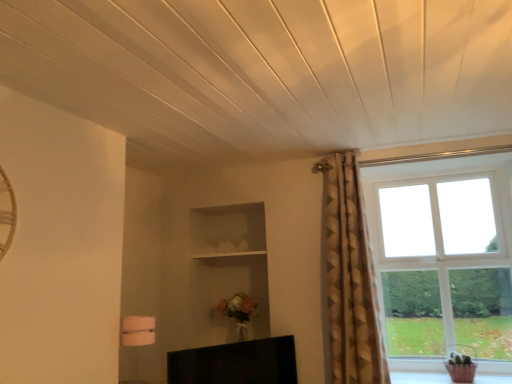
Question: Is clear glass window at right thinner than black glossy tv at lower center?

Choices:
 (A) yes
 (B) no

Answer: (B)

Question: Is clear glass window at right further to the viewer compared to black glossy tv at lower center?

Choices:
 (A) no
 (B) yes

Answer: (B)

Question: From the image's perspective, is clear glass window at right located above black glossy tv at lower center?

Choices:
 (A) no
 (B) yes

Answer: (B)

Question: Is clear glass window at right touching black glossy tv at lower center?

Choices:
 (A) yes
 (B) no

Answer: (B)

Question: Considering the relative positions of clear glass window at right and black glossy tv at lower center in the image provided, is clear glass window at right to the right of black glossy tv at lower center from the viewer's perspective?

Choices:
 (A) yes
 (B) no

Answer: (A)

Question: Based on their sizes in the image, would you say gold textured curtain at upper right is bigger or smaller than clear glass window at right?

Choices:
 (A) big
 (B) small

Answer: (A)

Question: In terms of height, does gold textured curtain at upper right look taller or shorter compared to clear glass window at right?

Choices:
 (A) tall
 (B) short

Answer: (A)

Question: Is gold textured curtain at upper right situated inside clear glass window at right or outside?

Choices:
 (A) outside
 (B) inside

Answer: (A)

Question: Is gold textured curtain at upper right in front of or behind clear glass window at right in the image?

Choices:
 (A) front
 (B) behind

Answer: (A)

Question: Is clear glass window at right inside or outside of white wooden shelf at center?

Choices:
 (A) inside
 (B) outside

Answer: (B)

Question: Considering the positions of clear glass window at right and white wooden shelf at center in the image, is clear glass window at right taller or shorter than white wooden shelf at center?

Choices:
 (A) short
 (B) tall

Answer: (B)

Question: Is clear glass window at right bigger or smaller than white wooden shelf at center?

Choices:
 (A) big
 (B) small

Answer: (A)

Question: Is clear glass window at right in front of or behind white wooden shelf at center in the image?

Choices:
 (A) behind
 (B) front

Answer: (B)

Question: Is point (212, 253) closer or farther from the camera than point (392, 271)?

Choices:
 (A) farther
 (B) closer

Answer: (A)

Question: From a real-world perspective, is white wooden shelf at center positioned above or below clear glass window at right?

Choices:
 (A) below
 (B) above

Answer: (B)